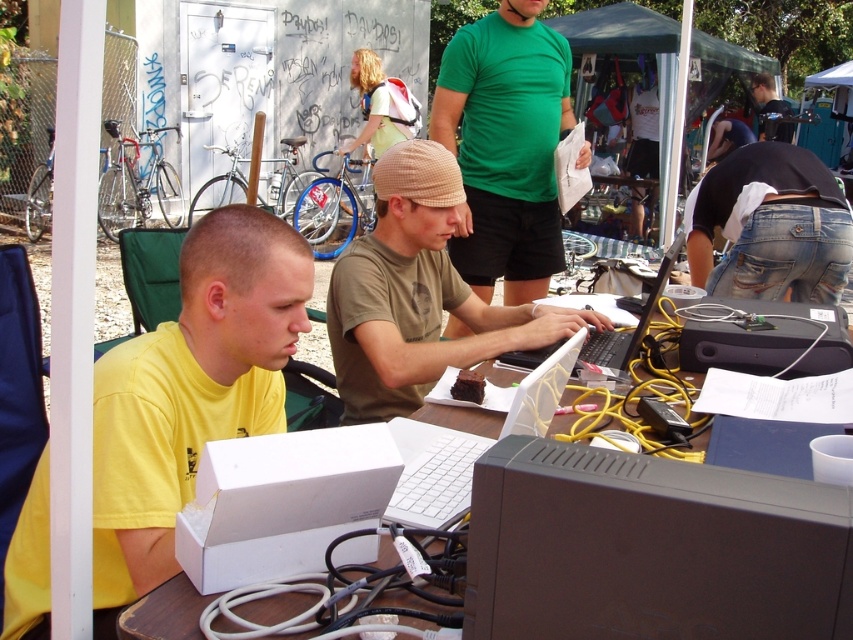
Is matte olive-green t-shirt at center to the right of dark green t-shirt at upper right from the viewer's perspective?

Incorrect, matte olive-green t-shirt at center is not on the right side of dark green t-shirt at upper right.

Who is positioned more to the left, matte olive-green t-shirt at center or dark green t-shirt at upper right?

Positioned to the left is matte olive-green t-shirt at center.

What do you see at coordinates (418, 292) in the screenshot? I see `matte olive-green t-shirt at center` at bounding box center [418, 292].

You are a GUI agent. You are given a task and a screenshot of the screen. Output one action in this format:
    pyautogui.click(x=<x>, y=<y>)
    Task: Click on the matte olive-green t-shirt at center
    
    Given the screenshot: What is the action you would take?
    tap(418, 292)

Between yellow matte shirt at left and brown wooden table at lower left, which one has less height?

With less height is brown wooden table at lower left.

Does point (219, 285) lie in front of point (172, 609)?

No, (219, 285) is further to viewer.

You are a GUI agent. You are given a task and a screenshot of the screen. Output one action in this format:
    pyautogui.click(x=<x>, y=<y>)
    Task: Click on the yellow matte shirt at left
    This screenshot has width=853, height=640.
    Given the screenshot: What is the action you would take?
    click(190, 392)

Who is taller, black plastic monitor at lower right or jeans at center?

jeans at center is taller.

Locate an element on the screen. Image resolution: width=853 pixels, height=640 pixels. black plastic monitor at lower right is located at coordinates (650, 548).